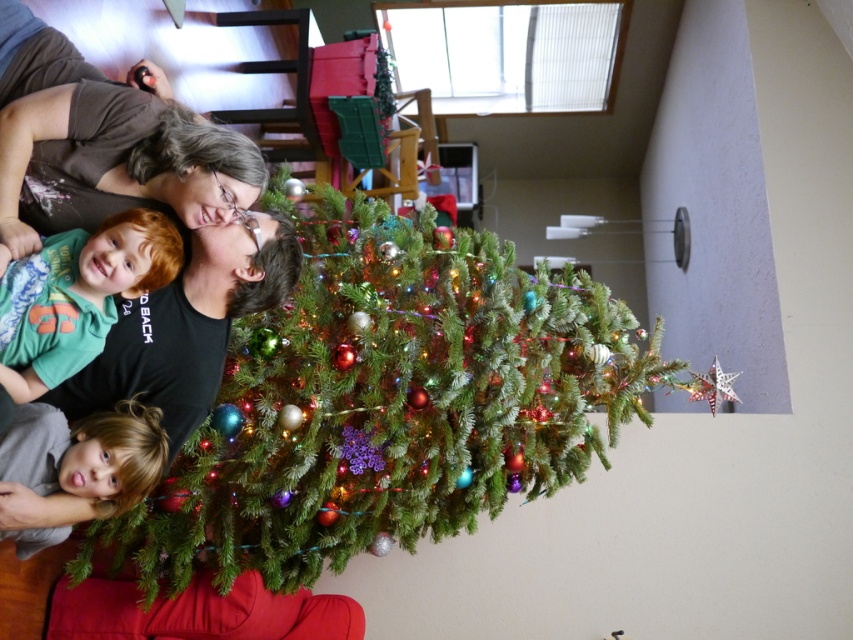
The width and height of the screenshot is (853, 640). What do you see at coordinates (386, 404) in the screenshot? I see `green matte christmas tree at center` at bounding box center [386, 404].

Is point (427, 452) behind point (109, 465)?

Yes, point (427, 452) is farther from viewer.

Is point (309, 333) closer to viewer compared to point (102, 461)?

That is False.

At what (x,y) coordinates should I click in order to perform the action: click on green matte christmas tree at center. Please return your answer as a coordinate pair (x, y). The width and height of the screenshot is (853, 640). Looking at the image, I should click on pyautogui.click(x=386, y=404).

Does green matte shirt at left appear on the right side of blonde hair at lower left?

Indeed, green matte shirt at left is positioned on the right side of blonde hair at lower left.

Does green matte shirt at left come behind blonde hair at lower left?

No, it is not.

Is point (49, 269) more distant than point (67, 436)?

No, it is in front of (67, 436).

The image size is (853, 640). Find the location of `green matte shirt at left`. green matte shirt at left is located at coordinates (77, 296).

Does green matte christmas tree at center appear on the left side of green matte shirt at left?

Incorrect, green matte christmas tree at center is not on the left side of green matte shirt at left.

Who is higher up, green matte christmas tree at center or green matte shirt at left?

Positioned higher is green matte shirt at left.

Is point (419, 349) closer to viewer compared to point (181, 240)?

No, (419, 349) is behind (181, 240).

Image resolution: width=853 pixels, height=640 pixels. I want to click on green matte christmas tree at center, so click(386, 404).